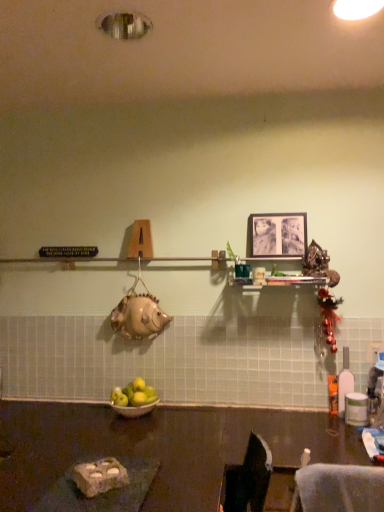
The height and width of the screenshot is (512, 384). In order to click on free space in front of silver metallic bowl at center in this screenshot , I will do `click(147, 431)`.